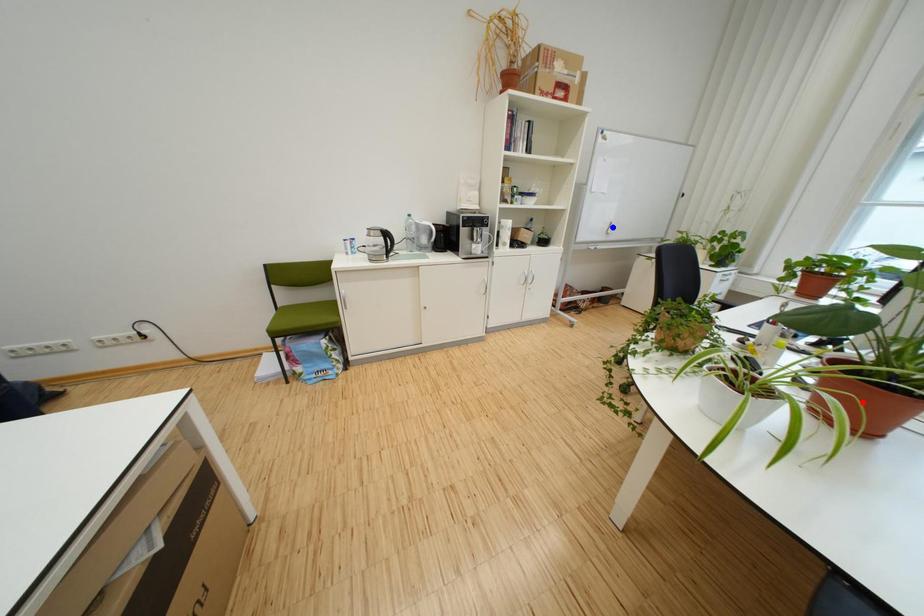
Question: In the image, two points are highlighted. Which point is nearer to the camera? Reply with the corresponding letter.

Choices:
 (A) blue point
 (B) red point

Answer: (B)